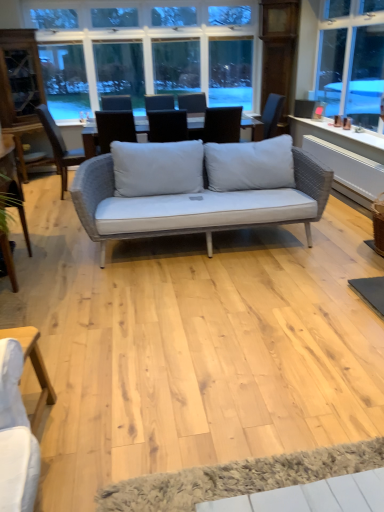
I want to click on free region under white textured yoga mat at lower center (from a real-world perspective), so [x=193, y=486].